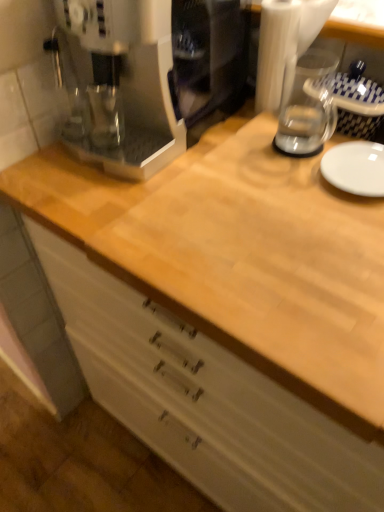
In order to click on free spot to the left of transparent glass blender at upper right in this screenshot , I will do `click(237, 121)`.